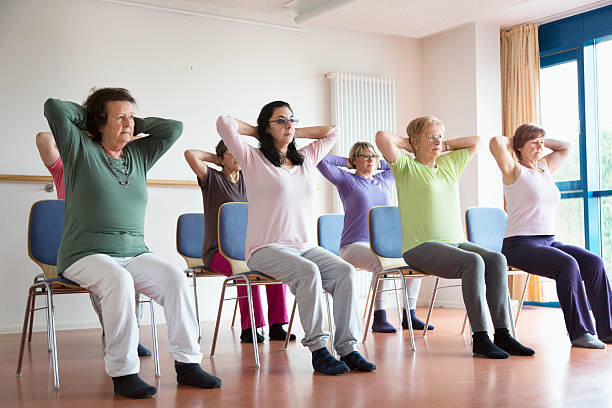
Image resolution: width=612 pixels, height=408 pixels. I want to click on seat backs, so click(x=40, y=225), click(x=193, y=225), click(x=234, y=224), click(x=327, y=230), click(x=379, y=230), click(x=482, y=222).